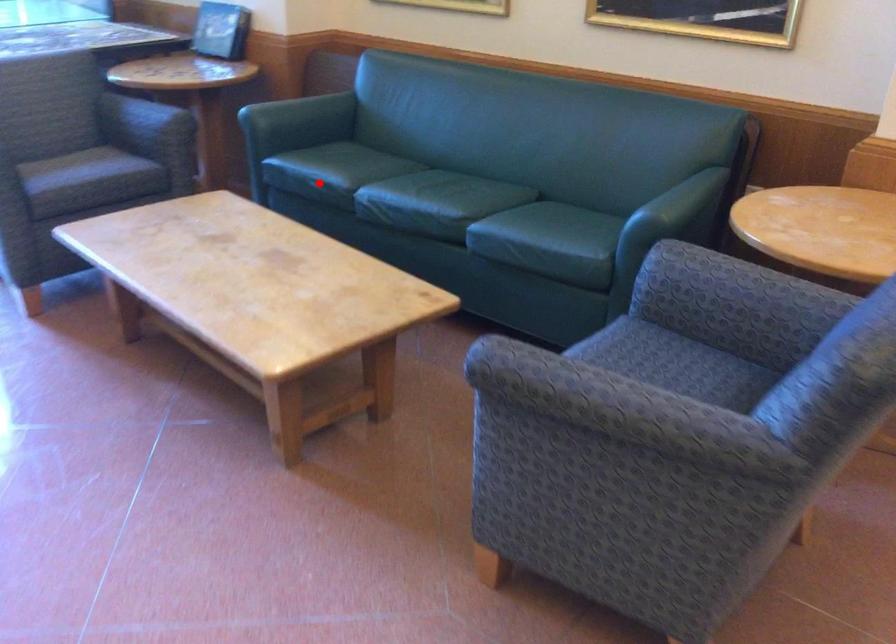
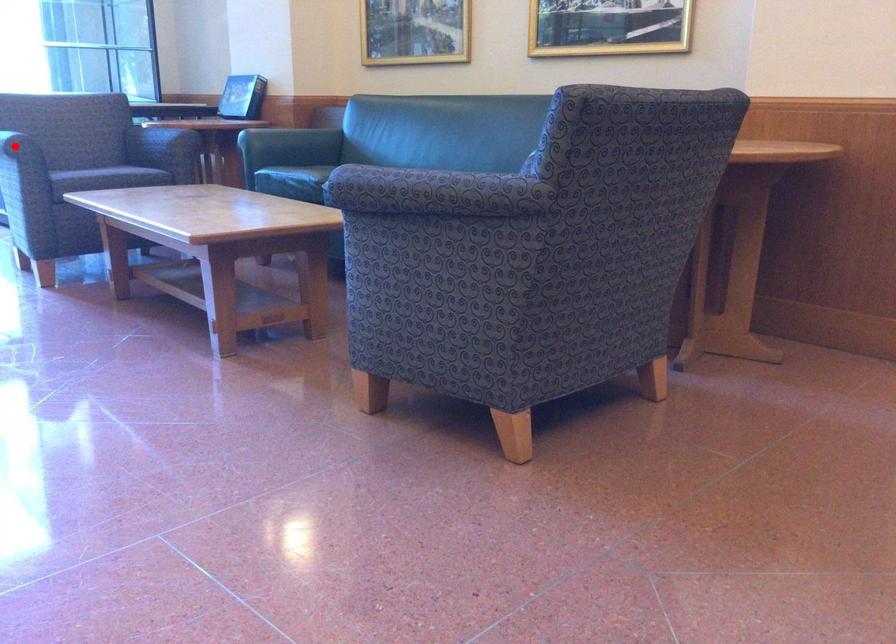
I am providing you with two images of the same scene from different viewpoints. A red point is marked on the first image and another point is marked on the second image. Does the point marked in image1 correspond to the same location as the one in image2?

No